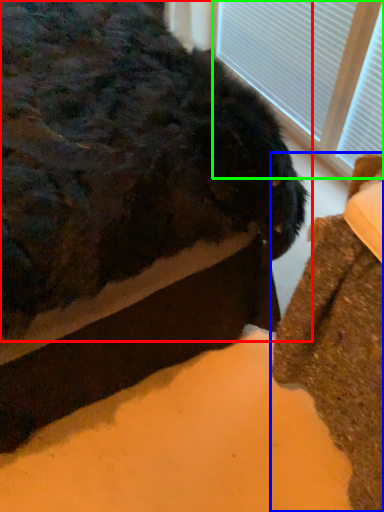
Question: Estimate the real-world distances between objects in this image. Which object is closer to animal (highlighted by a red box), furniture (highlighted by a blue box) or bay window (highlighted by a green box)?

Choices:
 (A) furniture
 (B) bay window

Answer: (A)